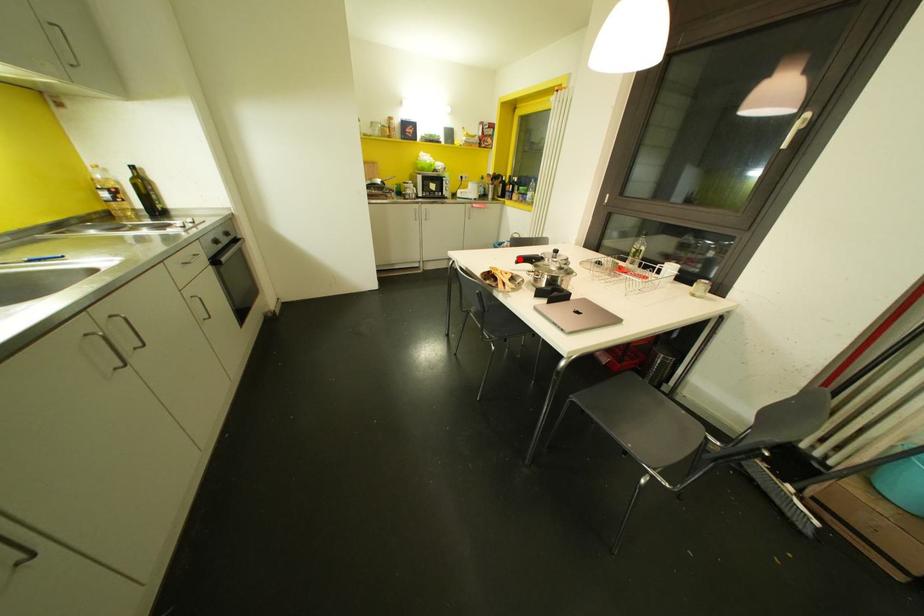
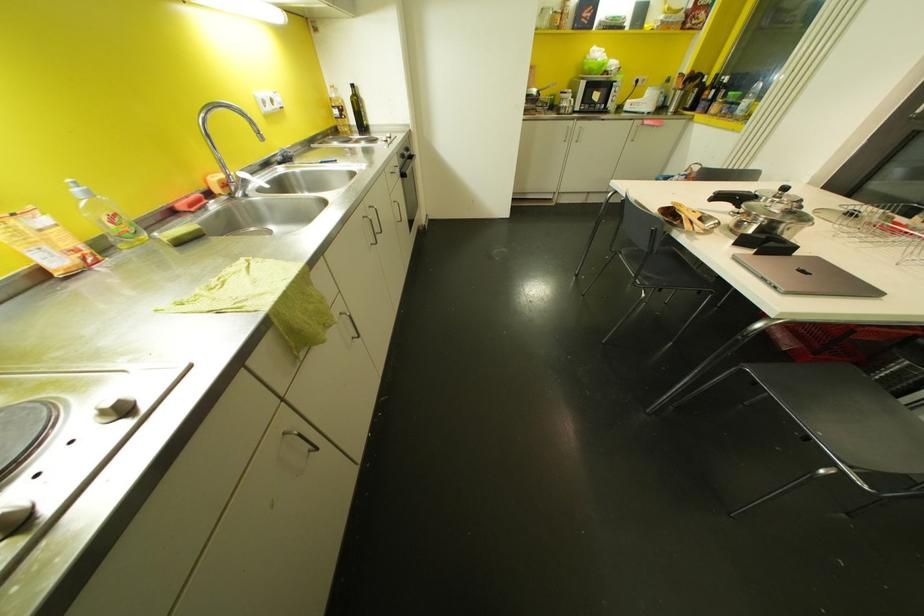
In the second image, find the point that corresponds to the highlighted location in the first image.

(718, 196)